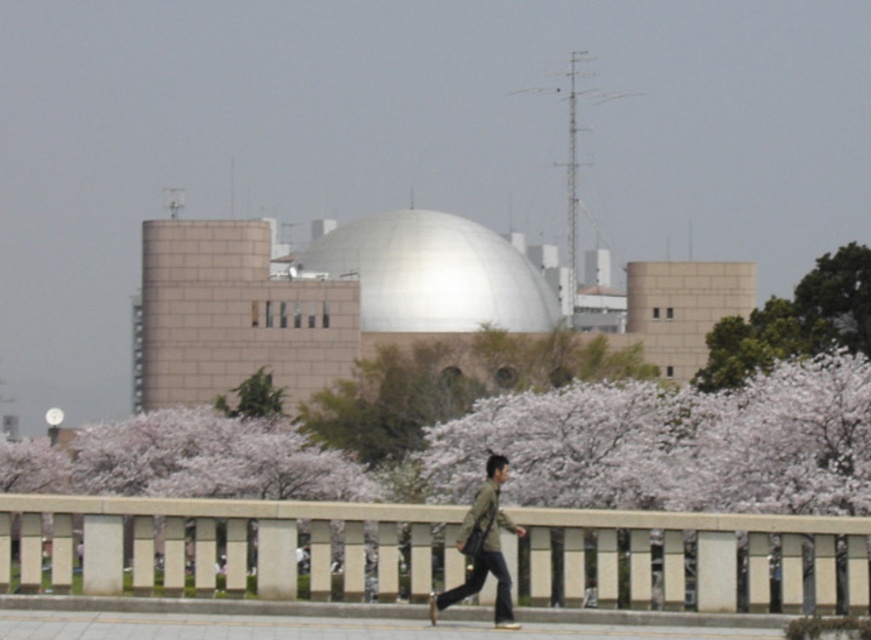
Is white smooth dome at center shorter than green leafy tree at upper right?

Incorrect, white smooth dome at center's height does not fall short of green leafy tree at upper right's.

Which of these two, white smooth dome at center or green leafy tree at upper right, stands shorter?

green leafy tree at upper right is shorter.

Where is `white smooth dome at center`? Image resolution: width=871 pixels, height=640 pixels. white smooth dome at center is located at coordinates (431, 275).

You are a GUI agent. You are given a task and a screenshot of the screen. Output one action in this format:
    pyautogui.click(x=<x>, y=<y>)
    Task: Click on the white smooth dome at center
    This screenshot has height=640, width=871.
    Given the screenshot: What is the action you would take?
    pyautogui.click(x=431, y=275)

Between beige concrete rail at center and white smooth dome at center, which one appears on the right side from the viewer's perspective?

beige concrete rail at center is more to the right.

Can you confirm if beige concrete rail at center is positioned to the left of white smooth dome at center?

Incorrect, beige concrete rail at center is not on the left side of white smooth dome at center.

The image size is (871, 640). I want to click on beige concrete rail at center, so click(221, 547).

Locate an element on the screen. This screenshot has height=640, width=871. beige concrete rail at center is located at coordinates pyautogui.click(x=221, y=547).

Between beige concrete rail at center and green matte jacket at center, which one is positioned higher?

green matte jacket at center is higher up.

Does beige concrete rail at center have a lesser height compared to green matte jacket at center?

In fact, beige concrete rail at center may be taller than green matte jacket at center.

Which is behind, point (289, 540) or point (496, 477)?

Point (289, 540)

You are a GUI agent. You are given a task and a screenshot of the screen. Output one action in this format:
    pyautogui.click(x=<x>, y=<y>)
    Task: Click on the beige concrete rail at center
    
    Given the screenshot: What is the action you would take?
    pyautogui.click(x=221, y=547)